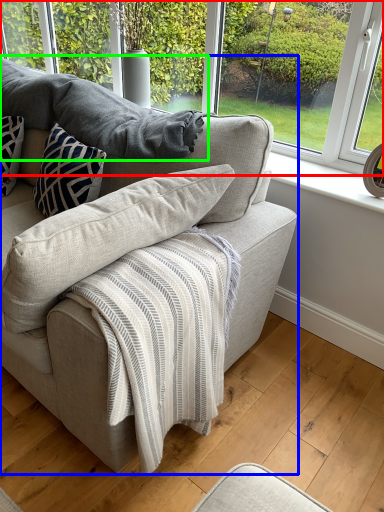
Question: Based on their relative distances, which object is nearer to window (highlighted by a red box)? Choose from studio couch (highlighted by a blue box) and gray (highlighted by a green box).

Choices:
 (A) studio couch
 (B) gray

Answer: (B)